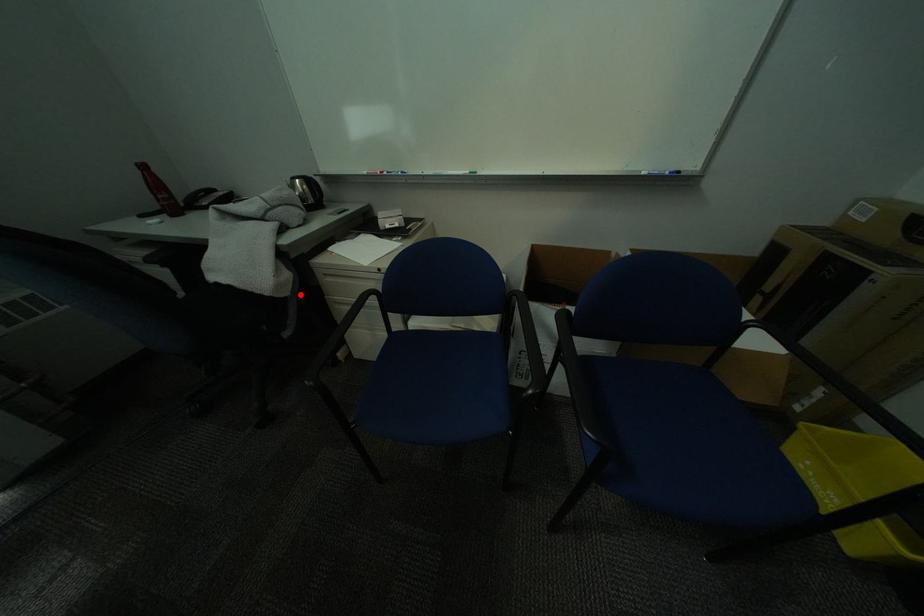
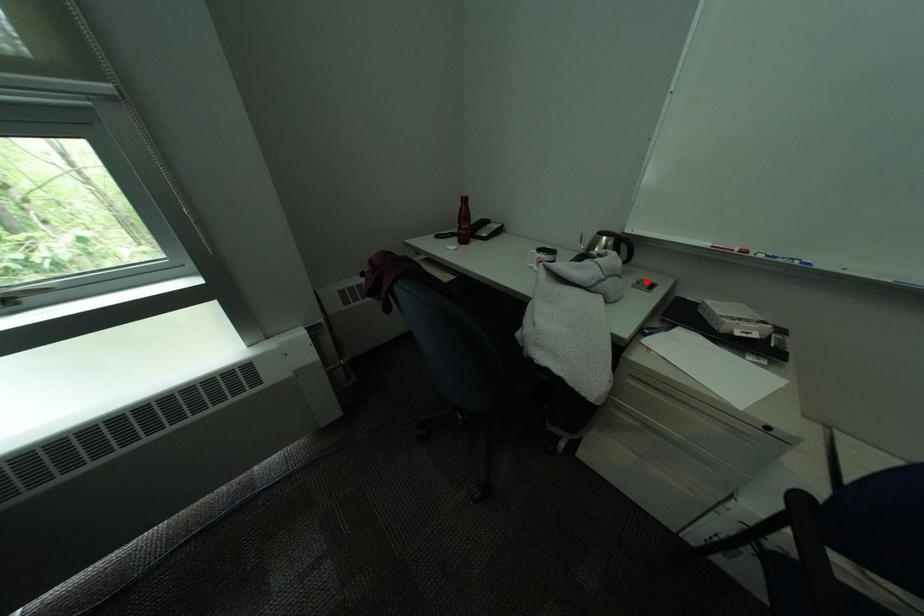
I am providing you with two images of the same scene from different viewpoints. A red point is marked on the first image and another point is marked on the second image. Do the highlighted points in image1 and image2 indicate the same real-world spot?

No